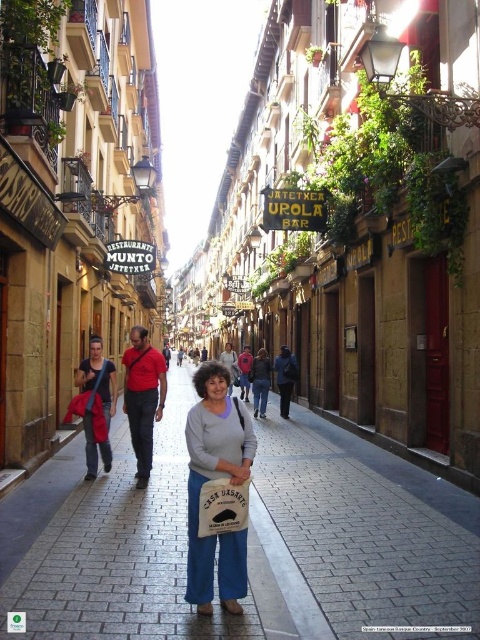
Question: Among these points, which one is farthest from the camera?

Choices:
 (A) (220, 468)
 (B) (395, 497)

Answer: (B)

Question: Is brown brick pavement at center below matte gray sweater at center?

Choices:
 (A) yes
 (B) no

Answer: (A)

Question: Is brown brick pavement at center positioned in front of matte gray sweater at center?

Choices:
 (A) no
 (B) yes

Answer: (B)

Question: Which object appears farthest from the camera in this image?

Choices:
 (A) brown brick pavement at center
 (B) matte gray sweater at center

Answer: (B)

Question: Among these points, which one is nearest to the camera?

Choices:
 (A) (186, 426)
 (B) (324, 467)

Answer: (A)

Question: Can you confirm if brown brick pavement at center is positioned above matte gray sweater at center?

Choices:
 (A) no
 (B) yes

Answer: (A)